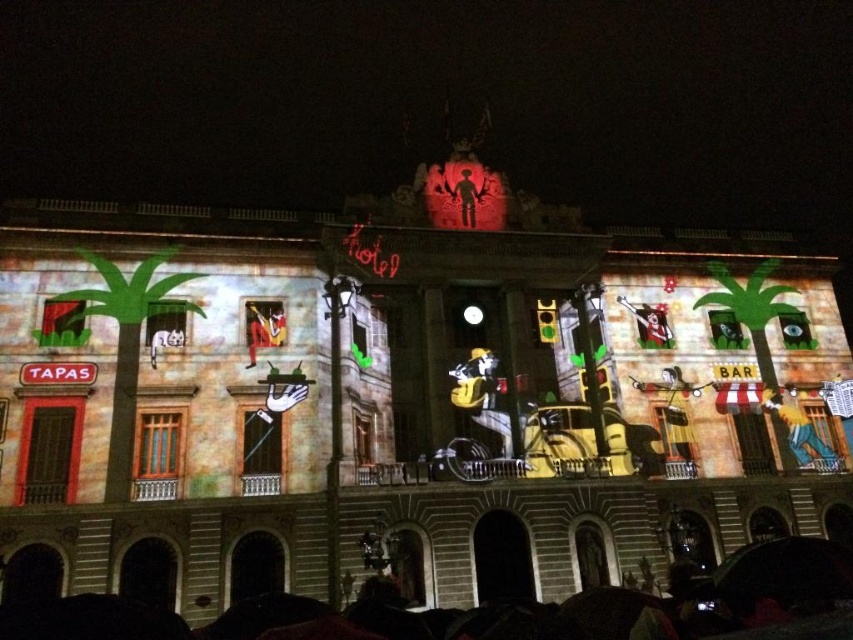
You are an event planner looking at the projected images on the historic building. You need to determine if the blue fabric person at lower right and the silhouette figure at center are overlapping. Based on their positions, can you tell if one is in front of the other?

Yes, the blue fabric person at lower right is in front of the silhouette figure at center, so they are overlapping.